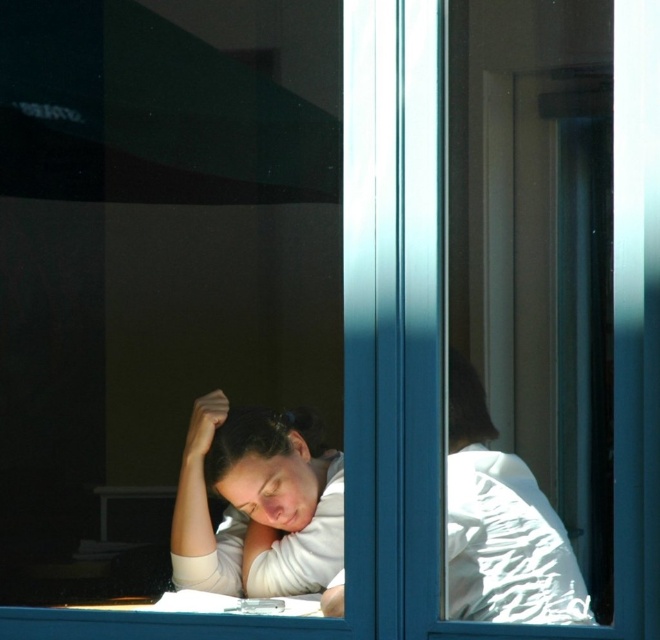
You are a photographer trying to capture the reflection on the window. You notice the white matte shirt at center and the smooth brown hair at center. Which object is positioned more to the left in the reflection?

A: The white matte shirt at center is positioned more to the left than the smooth brown hair at center in the reflection.

You are a photographer trying to capture the reflection on the window. You notice a point at coordinates (267, 465). What object in the scene does this point correspond to?

The point at coordinates (267, 465) corresponds to the matte white head at lower center.

You are a delivery robot with a package that needs to be placed between the matte white head at lower center and the smooth brown hair at center. The package is 18 inches long. Can it fit in the space between them?

The distance between the matte white head at lower center and the smooth brown hair at center is 17.14 inches. Since the package is 18 inches long, it cannot fit in the space between them.